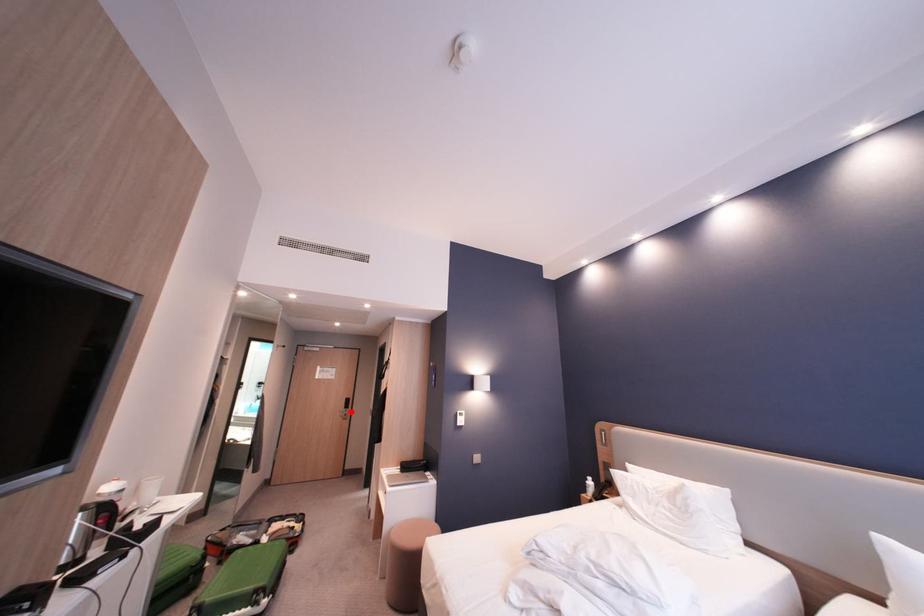
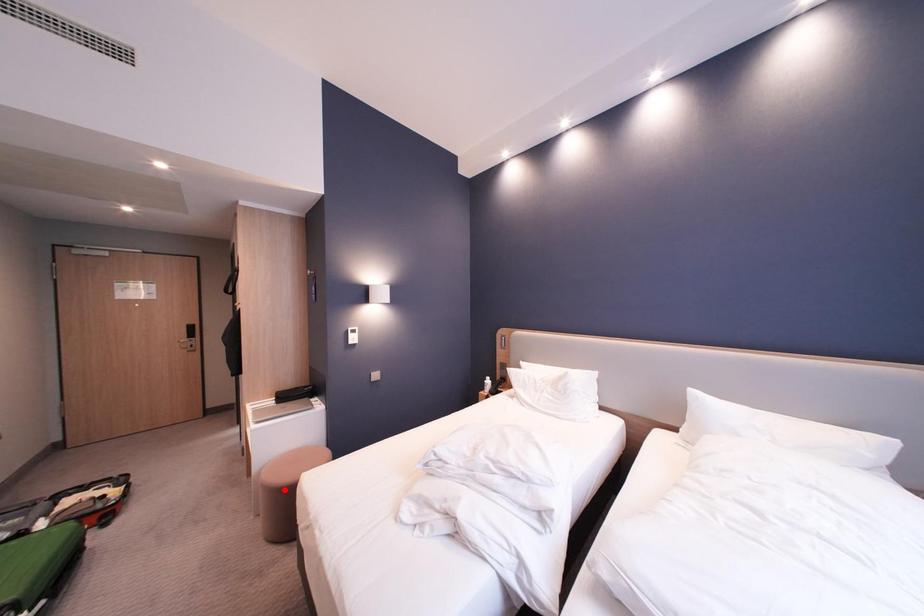
I am providing you with two images of the same scene from different viewpoints. A red point is marked on the first image and another point is marked on the second image. Do the highlighted points in image1 and image2 indicate the same real-world spot?

No